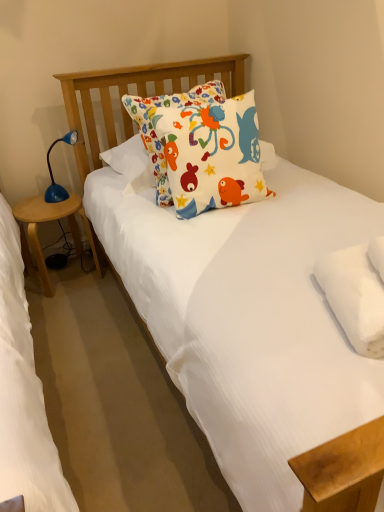
Image resolution: width=384 pixels, height=512 pixels. Identify the location of free space in front of blue plastic table lamp at left. (50, 209).